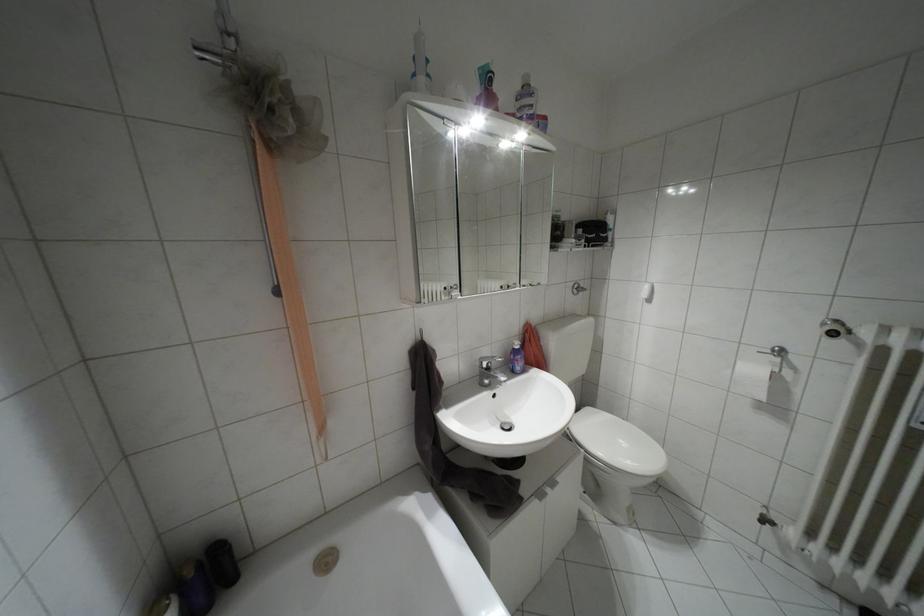
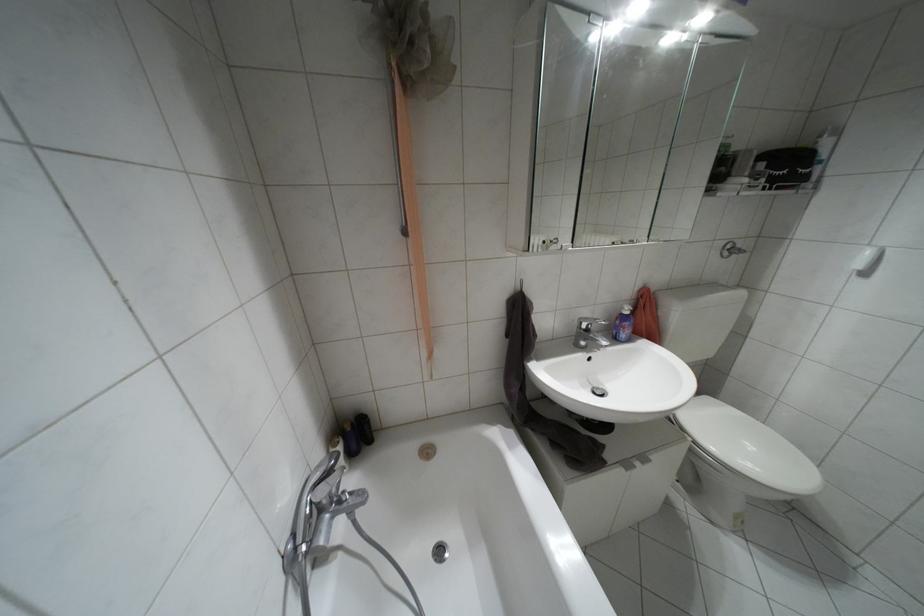
Where in the second image is the point corresponding to the point at 588,408 from the first image?

(706, 398)